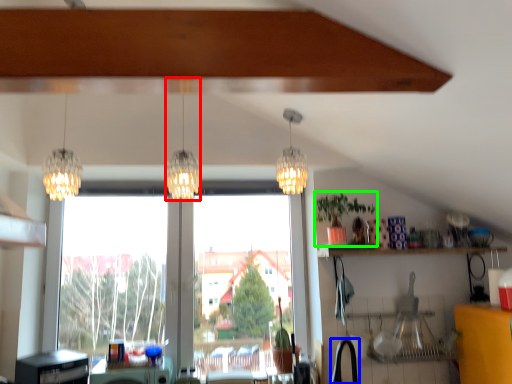
Question: Considering the real-world distances, which object is closest to lamp (highlighted by a red box)? faucet (highlighted by a blue box) or houseplant (highlighted by a green box).

Choices:
 (A) faucet
 (B) houseplant

Answer: (B)